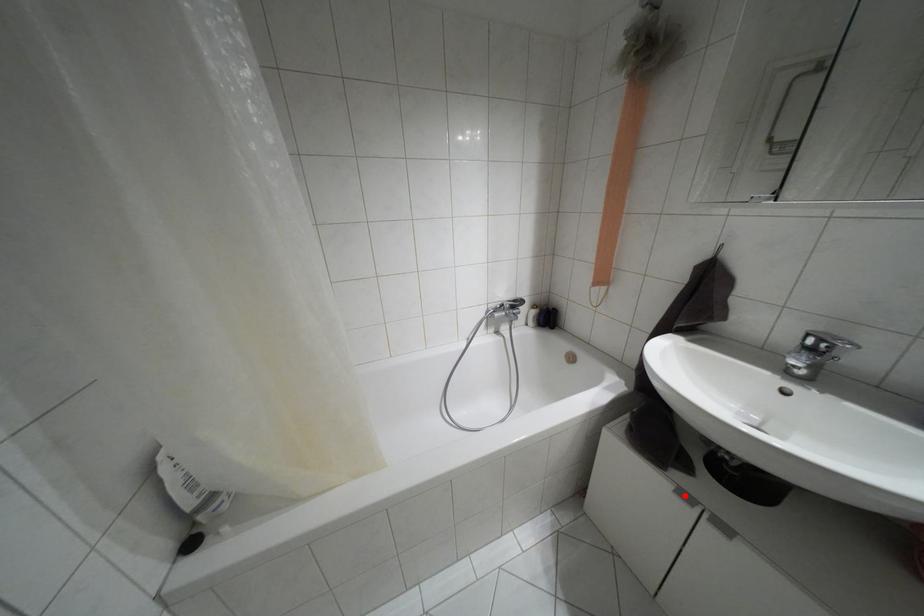
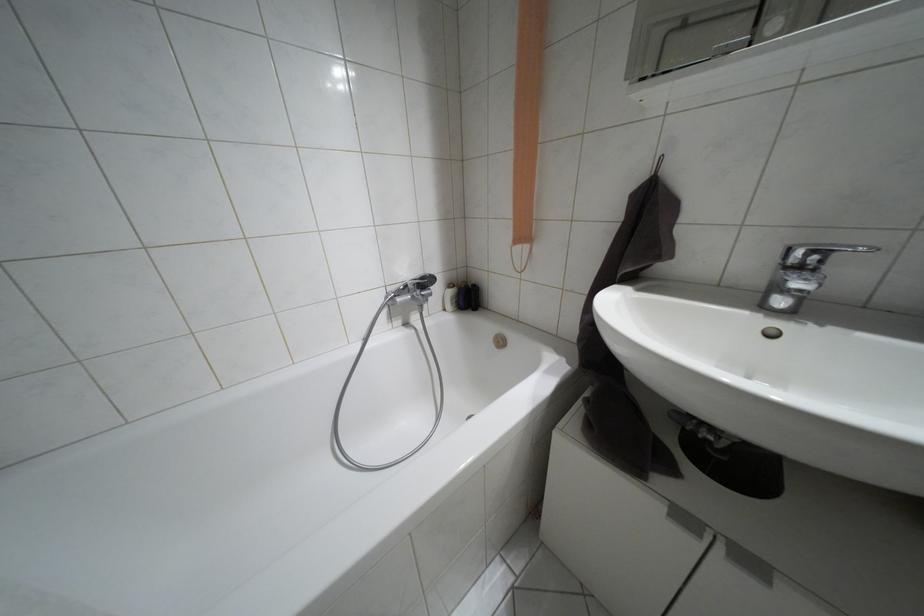
Where in the second image is the point corresponding to the highlighted location from the first image?

(684, 517)